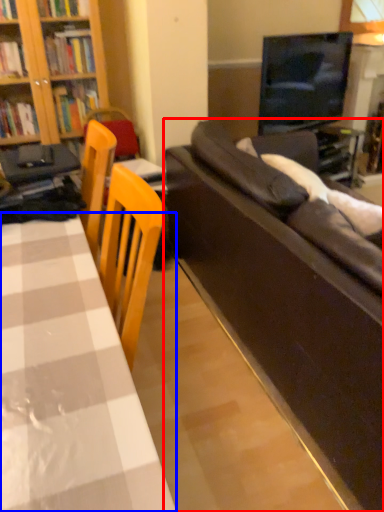
Question: Among these objects, which one is farthest to the camera, studio couch (highlighted by a red box) or table (highlighted by a blue box)?

Choices:
 (A) studio couch
 (B) table

Answer: (A)